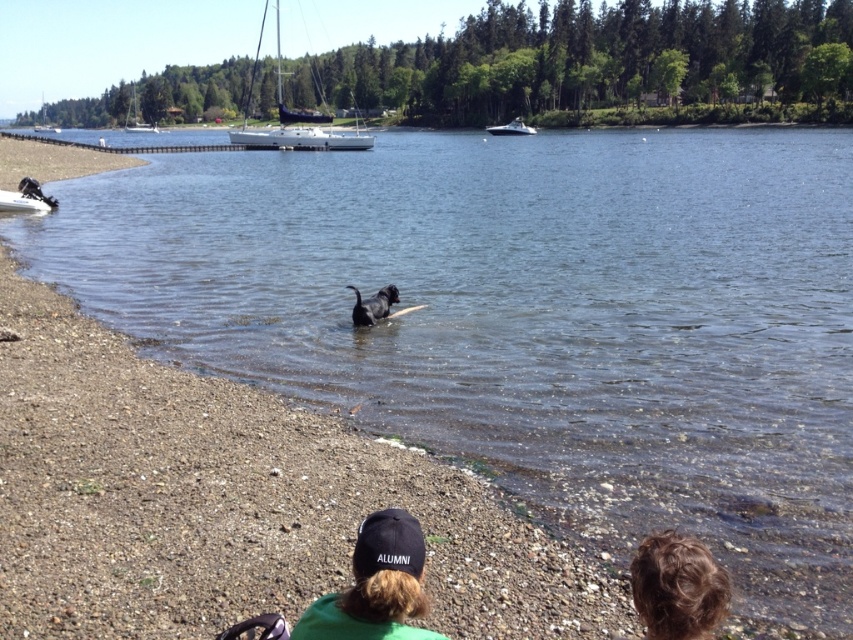
You are a photographer planning to capture the black sailboat at upper center in the center of your photo. Given its current position at point 0.188 on the x axis and 0.347 on the y axis, will you need to adjust your camera to move the boat to the center of the frame?

The black sailboat at upper center is already positioned at coordinates 0.188 on the x axis and 0.347 on the y axis. To center it, you would need to adjust the camera to move it to the center coordinates of the frame.

You are planning to launch a small toy boat into the lake. You see the black sailboat at upper center and the white plastic boat at center. Which boat is closer to the water surface?

The black sailboat at upper center is positioned over the white plastic boat at center, meaning it is closer to the water surface.

You are planning to take a photo of the white sailboat at upper left and the white plastic boat at center from the shore. Which boat will appear taller in the photo?

The white sailboat at upper left will appear taller in the photo because it is much taller than the white plastic boat at center according to the description.